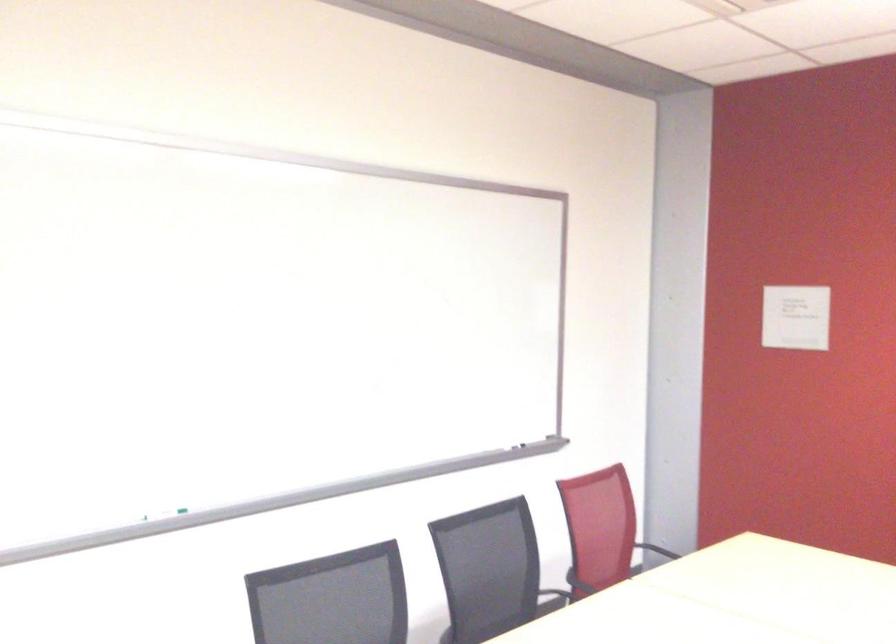
Where would you plac the red chair armrest? Please return your answer as a coordinate pair (x, y).

(657, 550)